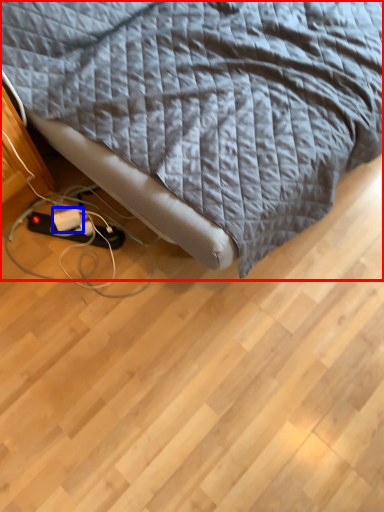
Question: Which of the following is the closest to the observer, bed (highlighted by a red box) or extension cord (highlighted by a blue box)?

Choices:
 (A) bed
 (B) extension cord

Answer: (A)